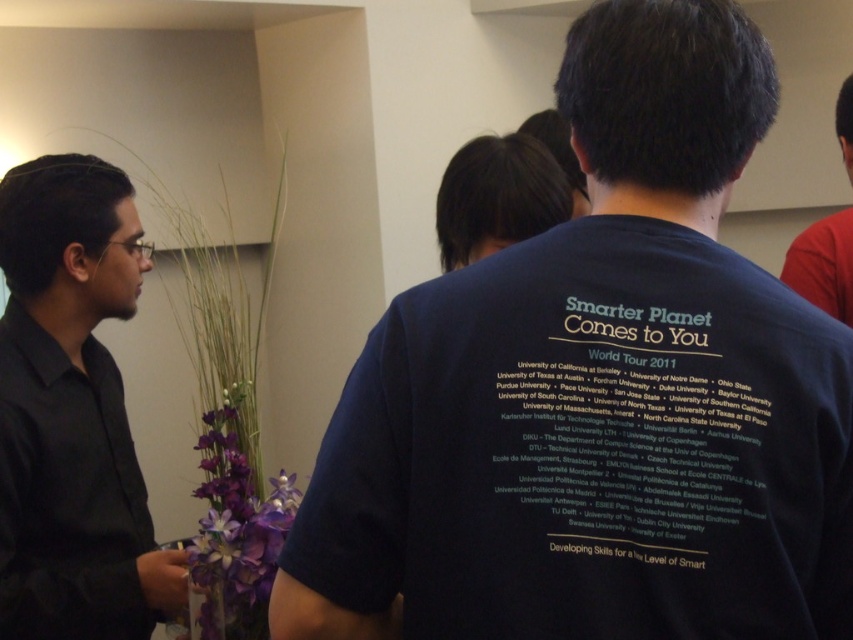
Question: Is black shirt at left to the right of red cotton shirt at upper right from the viewer's perspective?

Choices:
 (A) yes
 (B) no

Answer: (B)

Question: Can you confirm if dark blue t-shirt at center is thinner than black shirt at left?

Choices:
 (A) yes
 (B) no

Answer: (B)

Question: Which point is closer to the camera?

Choices:
 (A) [482, 140]
 (B) [836, 216]

Answer: (A)

Question: From the image, what is the correct spatial relationship of black shirt at left in relation to dark brown hair at center?

Choices:
 (A) left
 (B) right

Answer: (A)

Question: Which of the following is the farthest from the observer?

Choices:
 (A) red cotton shirt at upper right
 (B) dark blue t-shirt at center
 (C) dark brown hair at center
 (D) black shirt at left

Answer: (A)

Question: Among these points, which one is farthest from the camera?

Choices:
 (A) (843, 218)
 (B) (59, 340)

Answer: (A)